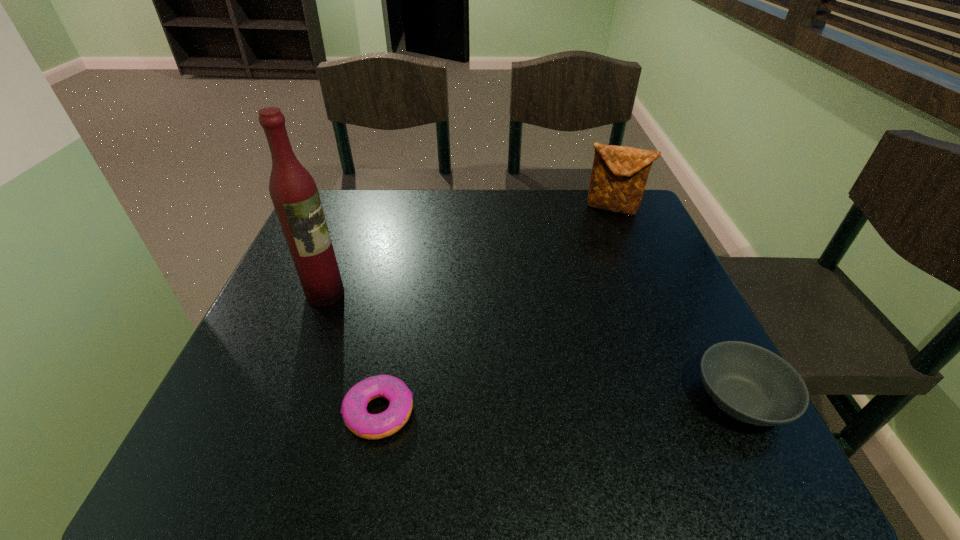
Locate which object is the third closest to the third shortest object. Please provide its 2D coordinates. Your answer should be formatted as a tuple, i.e. [(x, y)], where the tuple contains the x and y coordinates of a point satisfying the conditions above.

[(363, 424)]

You are a GUI agent. You are given a task and a screenshot of the screen. Output one action in this format:
    pyautogui.click(x=<x>, y=<y>)
    Task: Click on the free location that satisfies the following two spatial constraints: 1. on the back side of the shortest object; 2. on the left side of the third tallest object
    The width and height of the screenshot is (960, 540).
    Given the screenshot: What is the action you would take?
    pyautogui.click(x=381, y=400)

You are a GUI agent. You are given a task and a screenshot of the screen. Output one action in this format:
    pyautogui.click(x=<x>, y=<y>)
    Task: Click on the free space in the image that satisfies the following two spatial constraints: 1. on the front side of the third nearest object; 2. on the left side of the doughnut
    This screenshot has height=540, width=960.
    Given the screenshot: What is the action you would take?
    pyautogui.click(x=279, y=412)